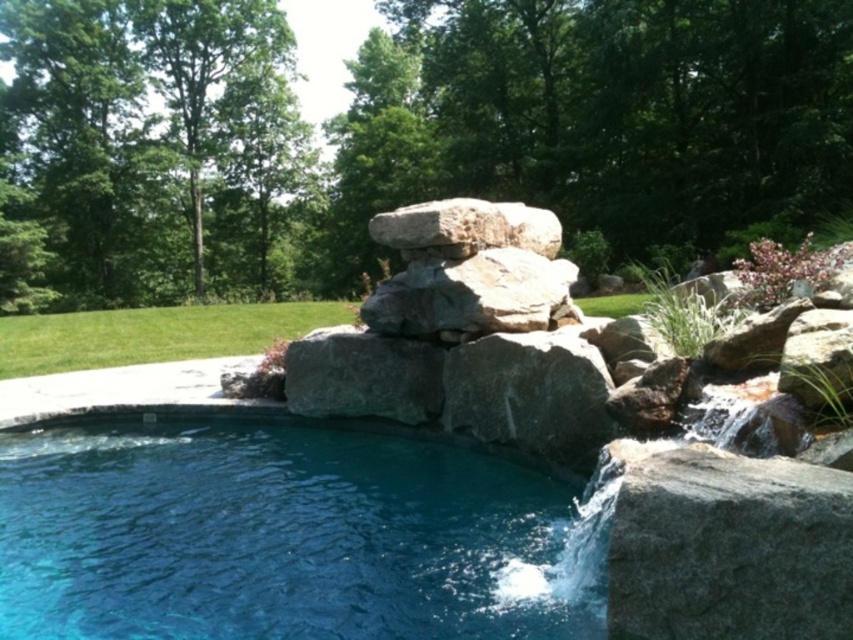
You are planning to place a small garden statue that requires a base 1 meter wide. You see the natural stone rock formation at center and the green grass at lower left. Which location would be suitable for placing the statue?

The green grass at lower left is wider than the natural stone rock formation at center, so the statue can be placed on the green grass at lower left since it has a wider base.

You are standing at the edge of the swimming pool and want to take a photo of both point (427, 467) and point (548, 225). Which point will appear larger in your photo?

Point (427, 467) will appear larger in the photo because it is closer to the camera than point (548, 225).

What are the coordinates of the green leafy tree at upper left in the image?

The green leafy tree at upper left is located at coordinates point (149, 152).